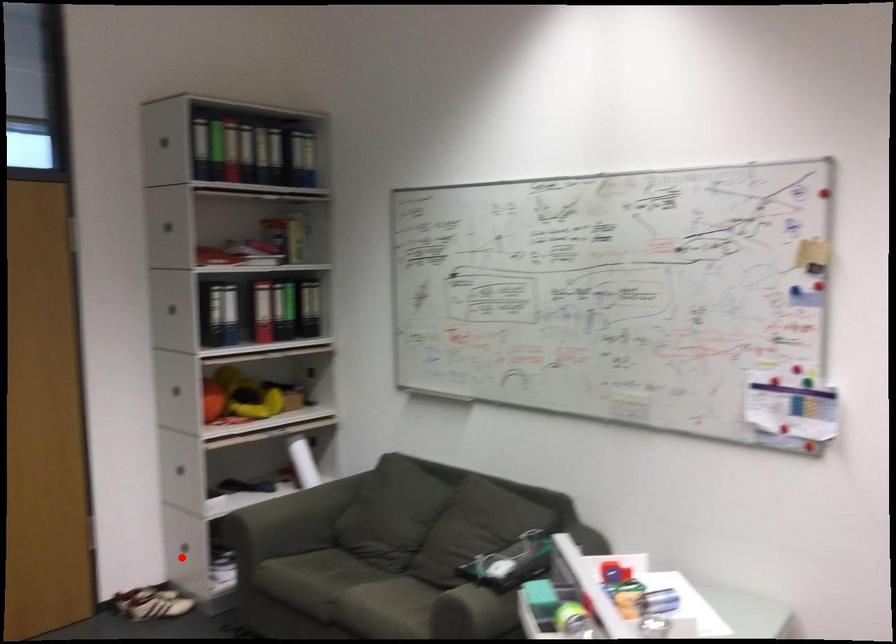
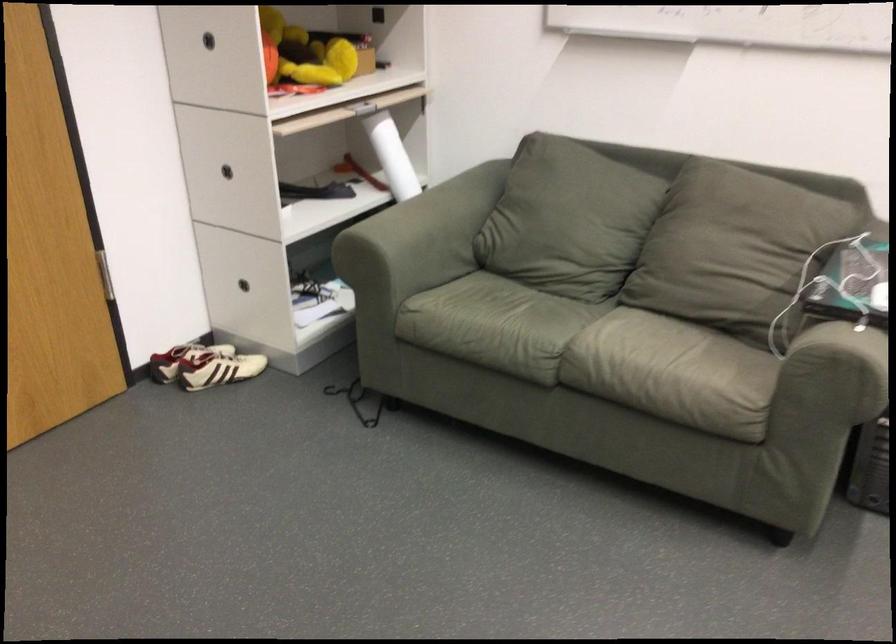
Question: I am providing you with two images of the same scene from different viewpoints. A red point is marked on the first image. Can you still see the location of the red point in image 2?

Choices:
 (A) Yes
 (B) No

Answer: (A)